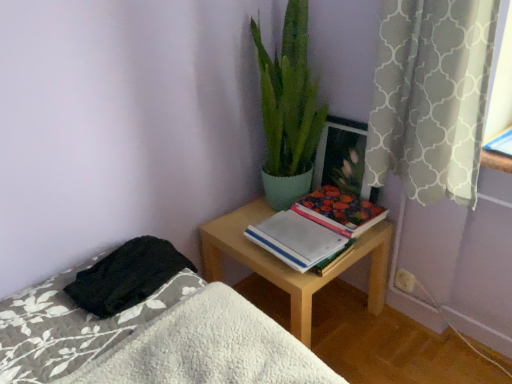
Question: Is light wood desk at center taller or shorter than hardcover floral book at center-right?

Choices:
 (A) short
 (B) tall

Answer: (B)

Question: From a real-world perspective, is light wood desk at center positioned above or below hardcover floral book at center-right?

Choices:
 (A) below
 (B) above

Answer: (A)

Question: Estimate the real-world distances between objects in this image. Which object is closer to the white plastic electric outlet at lower right?

Choices:
 (A) green matte plant at upper center
 (B) hardcover floral book at center-right
 (C) black fuzzy blanket at lower left
 (D) gray textured curtain at upper right
 (E) white paper notebook at center

Answer: (B)

Question: Based on their relative distances, which object is farther from the light wood desk at center?

Choices:
 (A) white paper notebook at center
 (B) white fluffy bed at lower left
 (C) wooden picture frame at upper right
 (D) gray textured curtain at upper right
 (E) white plastic electric outlet at lower right

Answer: (D)